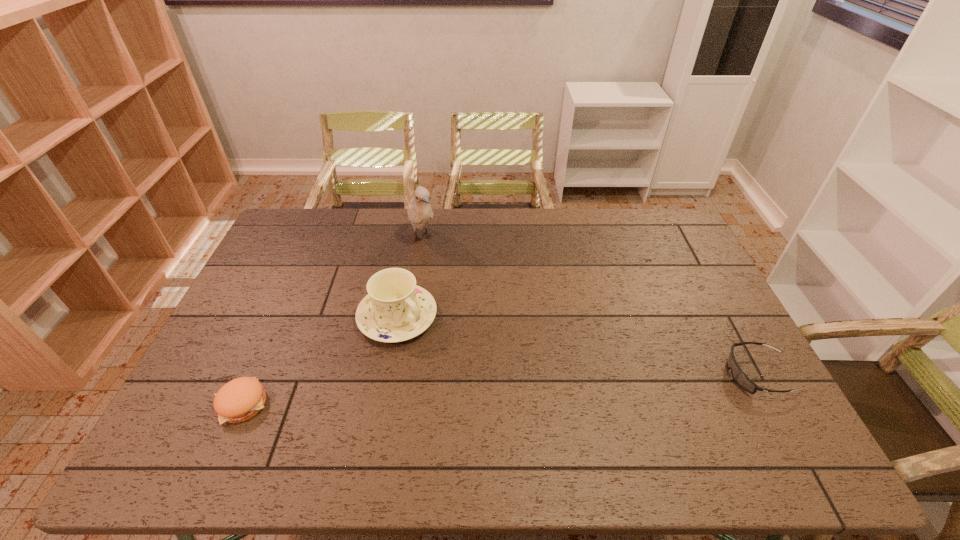
You are a GUI agent. You are given a task and a screenshot of the screen. Output one action in this format:
    pyautogui.click(x=<x>, y=<y>)
    Task: Click on the empty space between the leftmost object and the bird
    
    Given the screenshot: What is the action you would take?
    pyautogui.click(x=331, y=321)

Where is `blank region between the rightmost object and the chinaware`? This screenshot has width=960, height=540. blank region between the rightmost object and the chinaware is located at coordinates coord(578,345).

Where is `vacant space in between the goggles and the chinaware`? This screenshot has width=960, height=540. vacant space in between the goggles and the chinaware is located at coordinates (578, 345).

Locate an element on the screen. free point between the farthest object and the goggles is located at coordinates (589, 306).

Find the location of a particular element. Image resolution: width=960 pixels, height=540 pixels. empty space that is in between the rightmost object and the second farthest object is located at coordinates (578, 345).

This screenshot has height=540, width=960. I want to click on vacant area between the goggles and the farthest object, so click(x=589, y=306).

This screenshot has height=540, width=960. I want to click on free spot between the patty and the rightmost object, so click(x=500, y=389).

Where is `empty space between the farthest object and the rightmost object`? The width and height of the screenshot is (960, 540). empty space between the farthest object and the rightmost object is located at coordinates (589, 306).

In order to click on the second closest object to the goggles in this screenshot , I will do `click(420, 213)`.

Identify which object is located as the nearest to the chinaware. Please provide its 2D coordinates. Your answer should be formatted as a tuple, i.e. [(x, y)], where the tuple contains the x and y coordinates of a point satisfying the conditions above.

[(420, 213)]